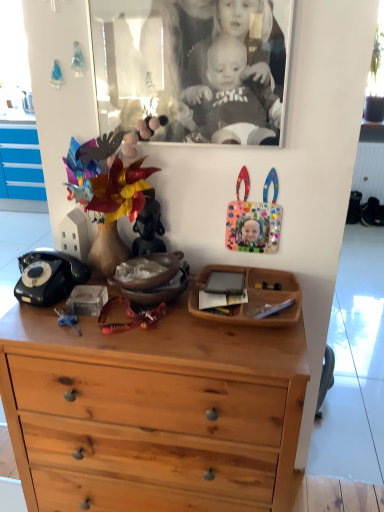
Question: Looking at their shapes, would you say matte ceramic vase at center, placed as the first toy when sorted from left to right, is wider or thinner than black glass picture frame at upper center?

Choices:
 (A) thin
 (B) wide

Answer: (B)

Question: Is matte ceramic vase at center, placed as the first toy when sorted from left to right, spatially inside black glass picture frame at upper center, or outside of it?

Choices:
 (A) inside
 (B) outside

Answer: (B)

Question: Based on their relative distances, which object is farther from the colorful plastic frame at upper right, the 1th toy in the right-to-left sequence?

Choices:
 (A) light brown wood chest of drawers at center
 (B) matte ceramic vase at center, placed as the first toy when sorted from left to right
 (C) black glass picture frame at upper center

Answer: (A)

Question: Estimate the real-world distances between objects in this image. Which object is farther from the colorful plastic frame at upper right, the 1th toy in the right-to-left sequence?

Choices:
 (A) black glass picture frame at upper center
 (B) light brown wood chest of drawers at center
 (C) matte ceramic vase at center, placed as the first toy when sorted from left to right

Answer: (B)